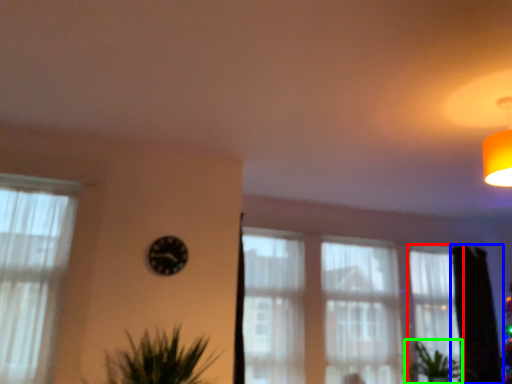
Question: Estimate the real-world distances between objects in this image. Which object is closer to curtain (highlighted by a red box), tree (highlighted by a blue box) or plant (highlighted by a green box)?

Choices:
 (A) tree
 (B) plant

Answer: (A)